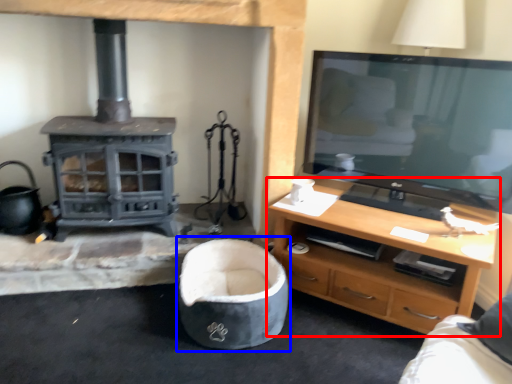
Question: Among these objects, which one is nearest to the camera, desk (highlighted by a red box) or bean bag chair (highlighted by a blue box)?

Choices:
 (A) desk
 (B) bean bag chair

Answer: (A)